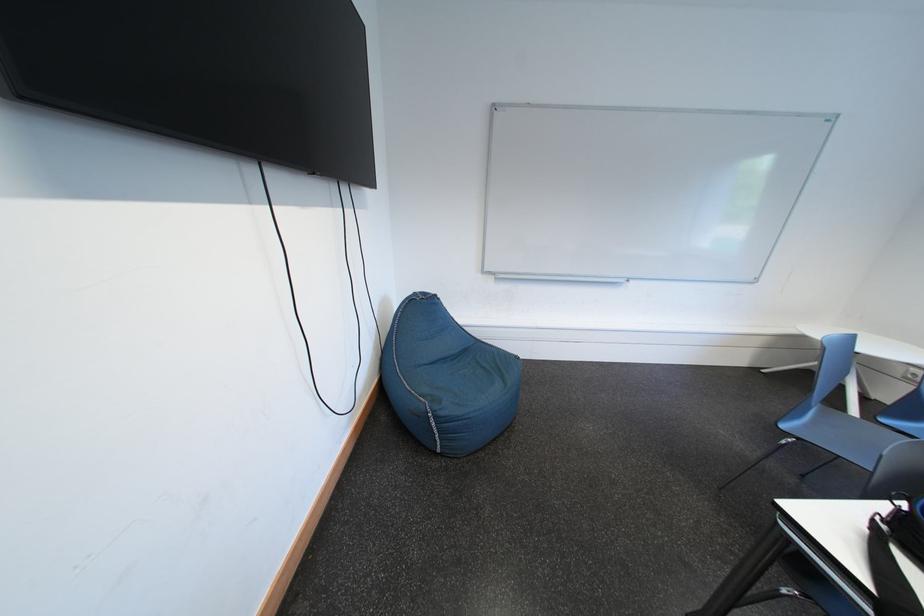
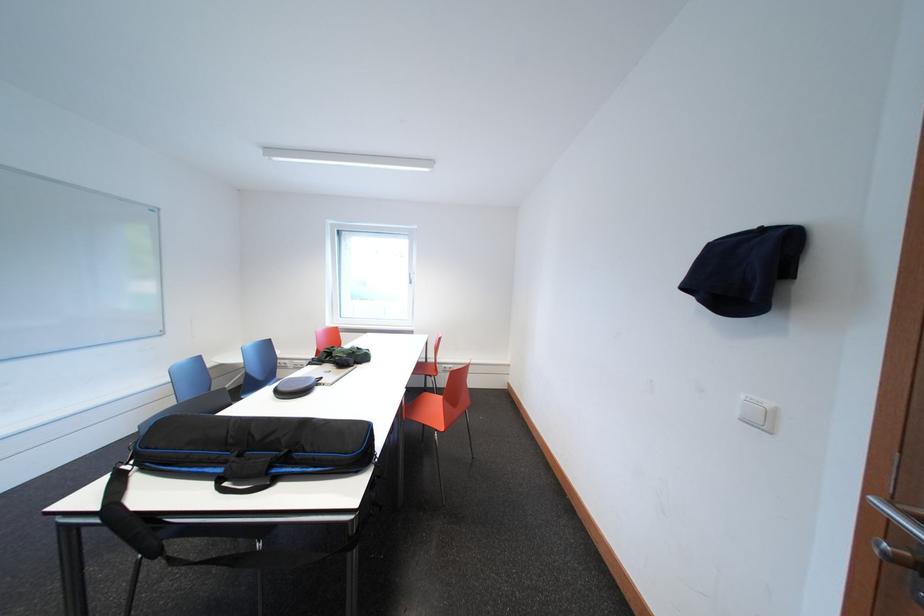
Question: Based on the continuous images, in which direction is the camera rotating? Reply with the corresponding letter.

Choices:
 (A) Left
 (B) Right
 (C) Up
 (D) Down

Answer: (B)